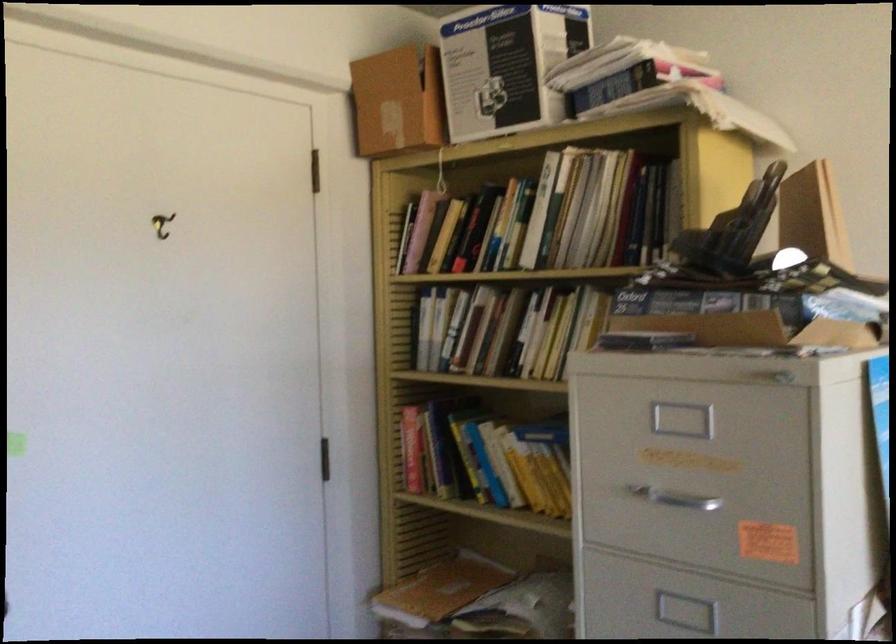
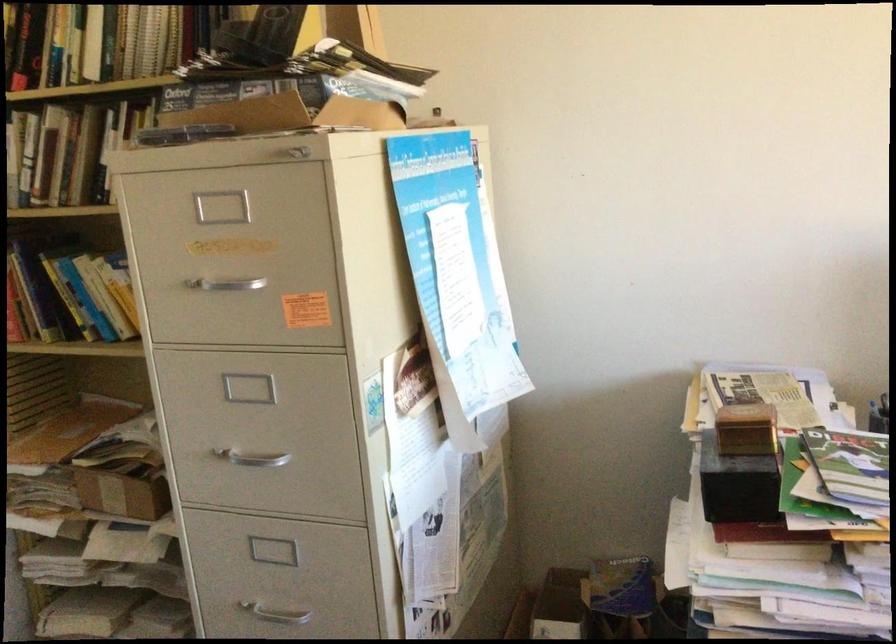
Where in the second image is the point corresponding to [437,460] from the first image?

(27, 301)